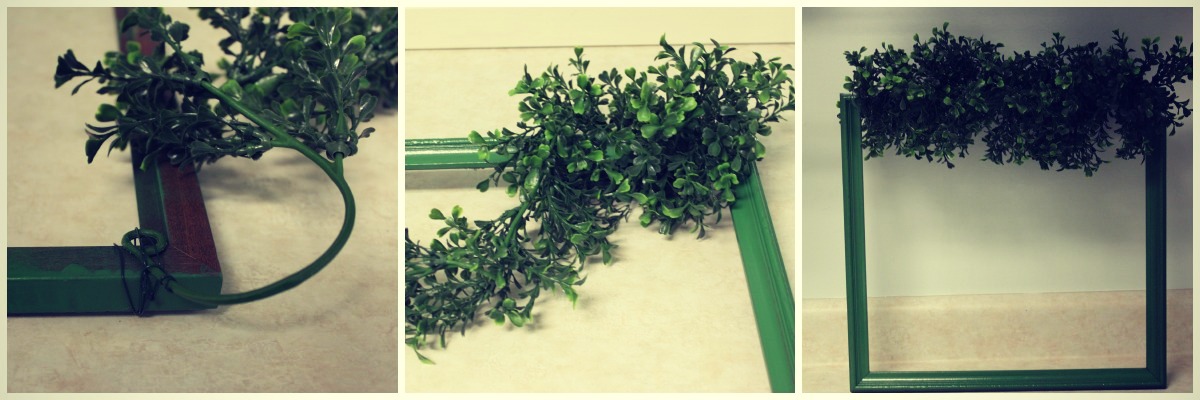
At what (x,y) coordinates should I click in order to perform the action: click on left plant. Please return your answer as a coordinate pair (x, y). The image size is (1200, 400). Looking at the image, I should click on (305, 59).